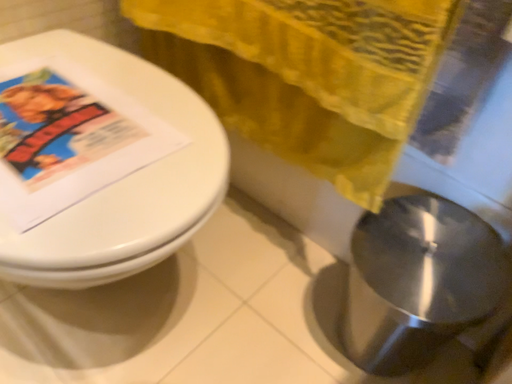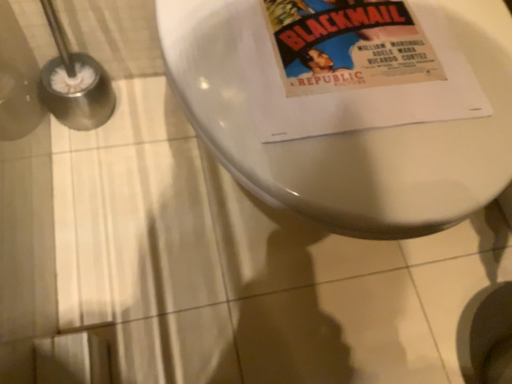
Question: How did the camera likely rotate when shooting the video?

Choices:
 (A) rotated left
 (B) rotated right

Answer: (A)